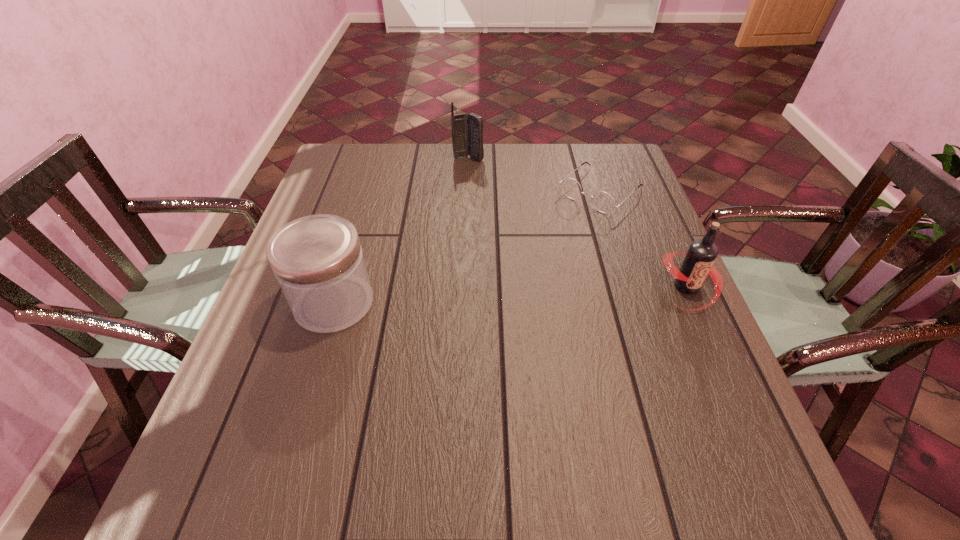
Image resolution: width=960 pixels, height=540 pixels. I want to click on vacant spot on the desktop that is between the jar and the root beer and is positioned on the front-facing side of the shortest object, so click(x=485, y=296).

Find the location of `free space on the desktop that is between the jar and the root beer and is positioned on the keyboard of the third object from right to left`. free space on the desktop that is between the jar and the root beer and is positioned on the keyboard of the third object from right to left is located at coordinates (544, 293).